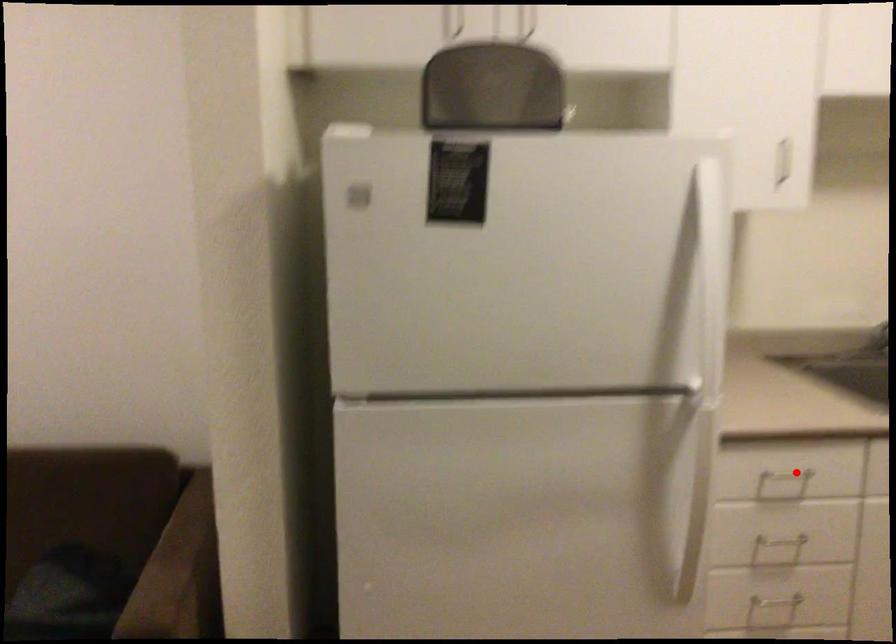
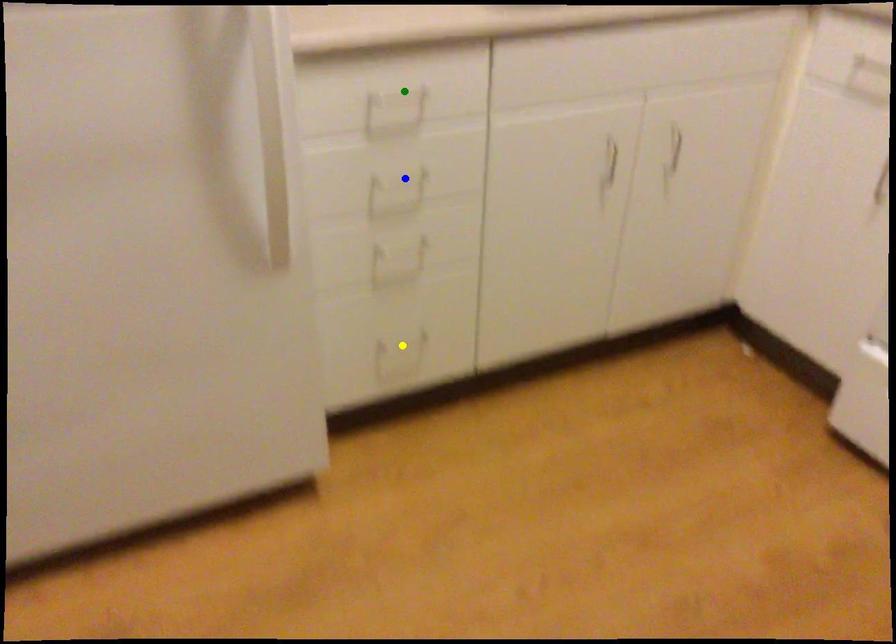
Question: I am providing you with two images of the same scene from different viewpoints. A red point is marked on the first image. You are given multiple points on the second image. In image 2, which mark is for the same physical point as the one in image 1?

Choices:
 (A) yellow point
 (B) green point
 (C) blue point

Answer: (B)